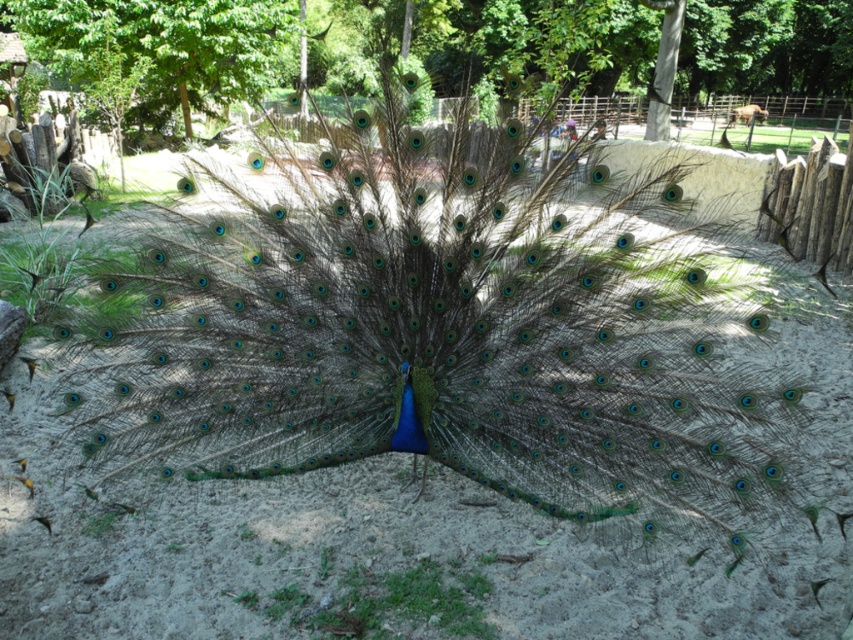
You are a birdwatcher observing the peacock and the two green leafy trees in the image. Which tree, the green leafy tree at center or the green leafy tree at upper center, is positioned higher in the scene?

The green leafy tree at center is located above the green leafy tree at upper center, so the green leafy tree at center is positioned higher in the scene.